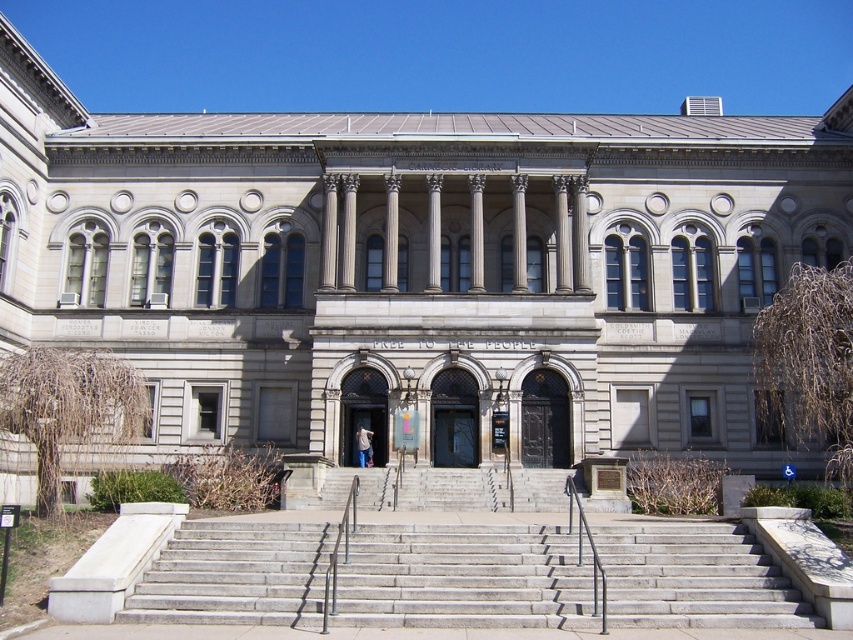
Question: Does gray concrete stairs at center have a smaller size compared to polished metal railing at center?

Choices:
 (A) no
 (B) yes

Answer: (A)

Question: Is gray concrete stairs at center below polished metal railing at center?

Choices:
 (A) no
 (B) yes

Answer: (B)

Question: Which object is closer to the camera taking this photo?

Choices:
 (A) polished metal railing at center
 (B) gray concrete stairs at center

Answer: (A)

Question: Is gray concrete stairs at center positioned before polished metal railing at center?

Choices:
 (A) yes
 (B) no

Answer: (B)

Question: Which of the following is the closest to the observer?

Choices:
 (A) polished metal railing at center
 (B) gray concrete stairs at center

Answer: (A)

Question: Which object appears closest to the camera in this image?

Choices:
 (A) gray concrete stairs at center
 (B) polished metal railing at center

Answer: (B)